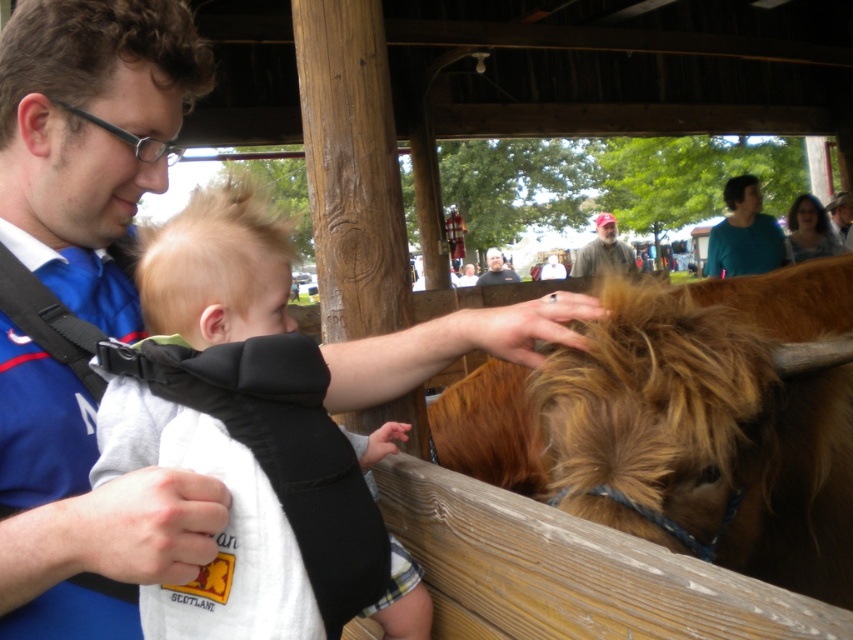
You are a photographer at the farm fair and want to capture a photo that includes both the light gray fabric baby carrier at center and the brown leather hat at upper right. Given that your camera has a maximum focus range of 20 feet, will you be able to get both objects in focus at the same time?

The light gray fabric baby carrier at center and the brown leather hat at upper right are 22.20 feet apart, which exceeds the camera maximum focus range of 20 feet. Therefore, you cannot get both objects in focus at the same time.

You are standing in front of the wooden barrier at the farm fair. There are two points marked on the image. The first point is at coordinate point(270,545) and the second is at point(833,202). If you want to touch the point that is closer to you, which coordinate should you aim for?

The point at coordinate point(270,545) is closer to the camera, so you should aim for that coordinate.

You are a farmer trying to locate the brown fuzzy bull at center in the image. What are its coordinates?

The brown fuzzy bull at center is located at coordinates (685,424).